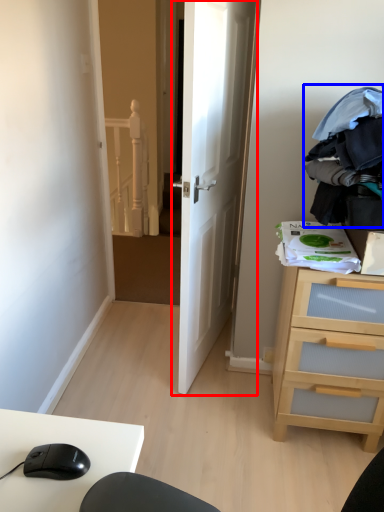
Question: Which point is further to the camera, door (highlighted by a red box) or clothing (highlighted by a blue box)?

Choices:
 (A) door
 (B) clothing

Answer: (A)